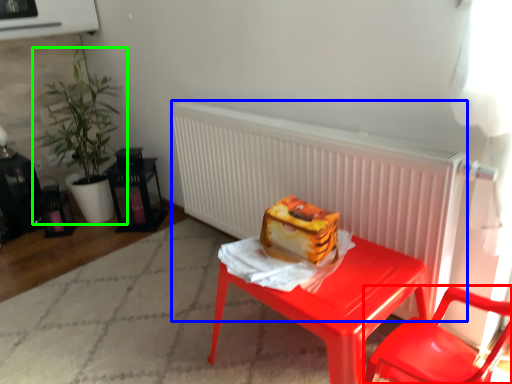
Question: Considering the real-world distances, which object is closest to chair (highlighted by a red box)? radiator (highlighted by a blue box) or houseplant (highlighted by a green box).

Choices:
 (A) radiator
 (B) houseplant

Answer: (A)